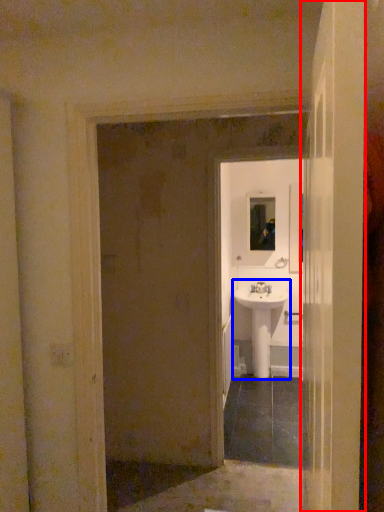
Question: Which of the following is the farthest to the observer, door (highlighted by a red box) or sink (highlighted by a blue box)?

Choices:
 (A) door
 (B) sink

Answer: (B)